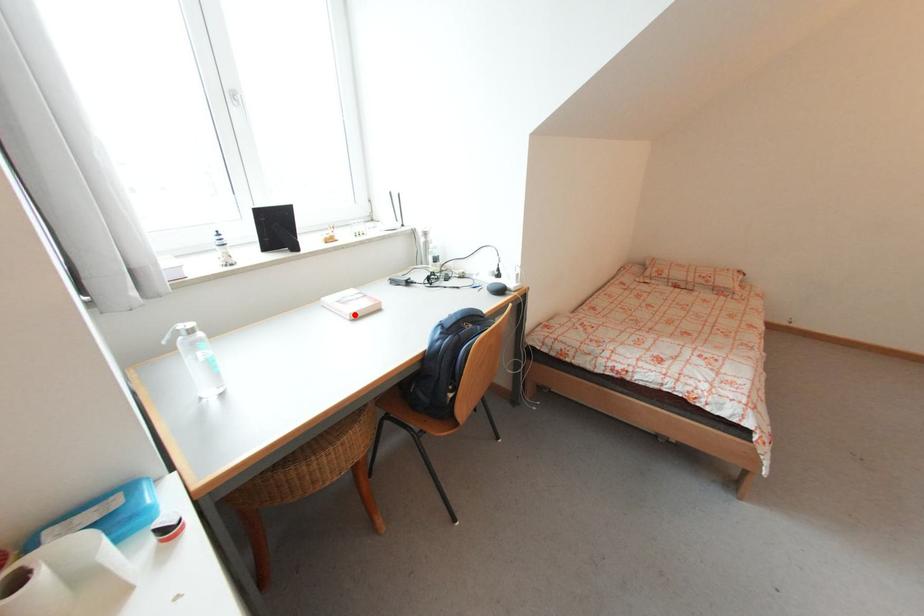
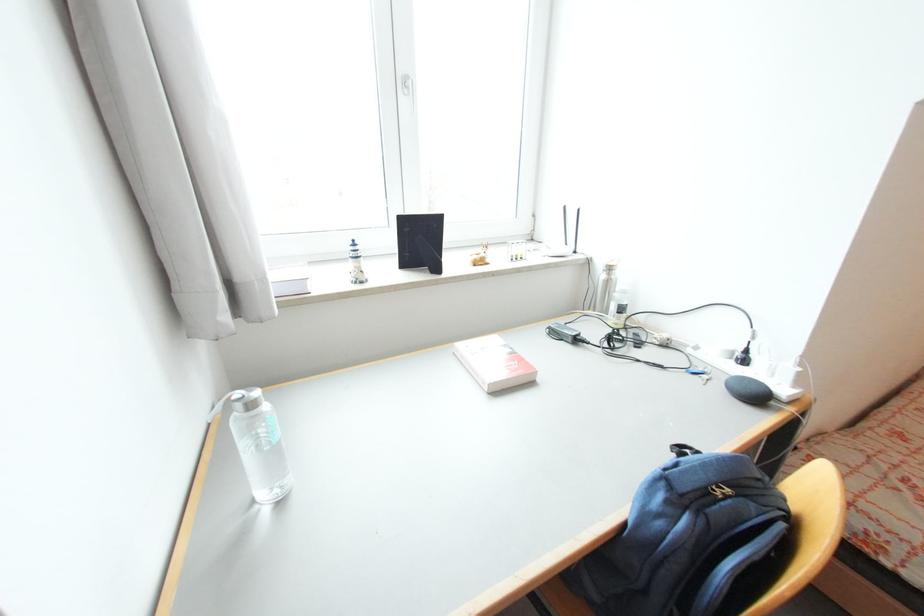
Find the pixel in the second image that matches the highlighted location in the first image.

(493, 386)